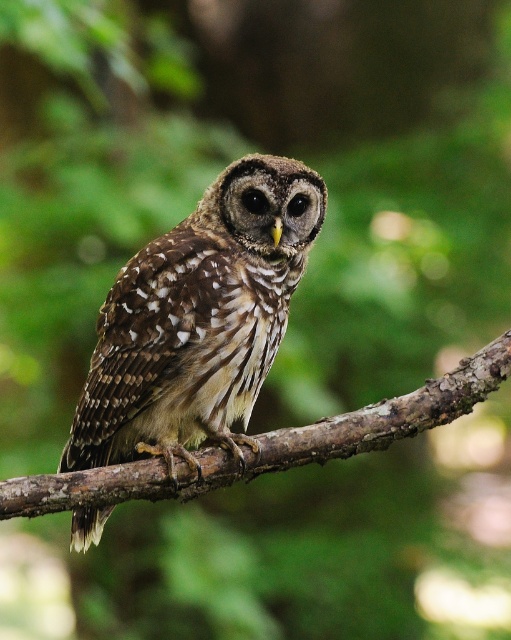
You are a birdwatcher observing the brown speckled owl at center and the brown rough branch at center. Which object is positioned higher in the image?

The brown speckled owl at center is positioned above the brown rough branch at center, so it is higher in the image.

You are a birdwatcher trying to observe the brown speckled owl at center and the brown rough branch at center. Which object is closer to you?

The brown speckled owl at center is closer to you because it is positioned in front of the brown rough branch at center.

You are an ornithologist observing the brown speckled owl at center perched on the brown rough branch at center. Based on their widths, which object is narrower?

The brown speckled owl at center has a lesser width compared to the brown rough branch at center, so the brown speckled owl at center is narrower.